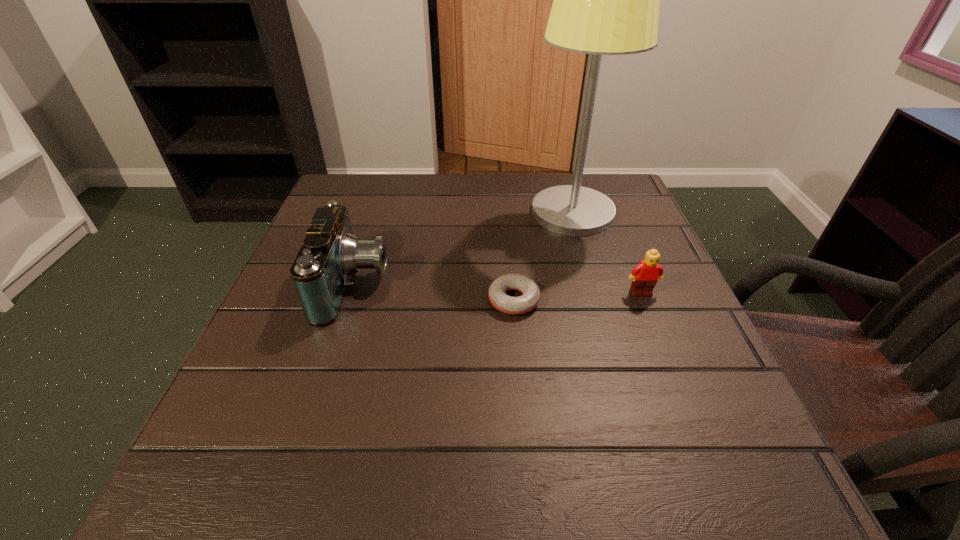
Find the location of a particular element. The height and width of the screenshot is (540, 960). free space that satisfies the following two spatial constraints: 1. on the front-facing side of the third object from right to left; 2. on the right side of the third shortest object is located at coordinates (349, 300).

This screenshot has height=540, width=960. What are the coordinates of `free region that satisfies the following two spatial constraints: 1. on the front-facing side of the leftmost object; 2. on the right side of the second object from left to right` in the screenshot? It's located at (349, 300).